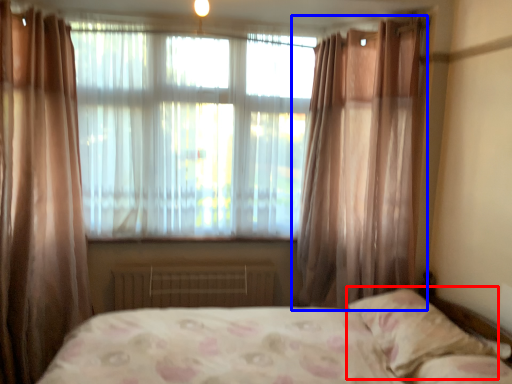
Question: Which object appears closest to the camera in this image, pillow (highlighted by a red box) or curtain (highlighted by a blue box)?

Choices:
 (A) pillow
 (B) curtain

Answer: (A)